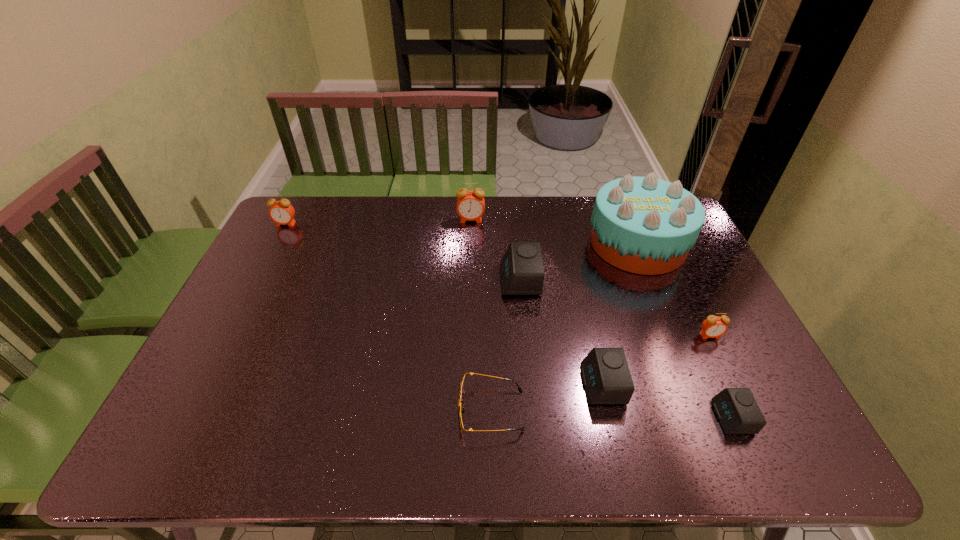
Where is `the second black alarm clock from right to left`? the second black alarm clock from right to left is located at coordinates (606, 377).

The image size is (960, 540). Identify the location of the rightmost black alarm clock. (737, 410).

You are a GUI agent. You are given a task and a screenshot of the screen. Output one action in this format:
    pyautogui.click(x=<x>, y=<y>)
    Task: Click on the smallest black alarm clock
    The width and height of the screenshot is (960, 540).
    Given the screenshot: What is the action you would take?
    pyautogui.click(x=737, y=410)

Find the location of `black sunglasses`. black sunglasses is located at coordinates (460, 410).

Locate an element on the screen. This screenshot has height=540, width=960. free space located 0.370m on the left of the tallest object is located at coordinates (478, 244).

At what (x,y) coordinates should I click in order to perform the action: click on free spot located on the face of the biggest pink alarm clock. Please return your answer as a coordinate pair (x, y). Looking at the image, I should click on (469, 274).

What are the coordinates of `free point located 0.130m on the face of the second smallest pink alarm clock` in the screenshot? It's located at (272, 251).

This screenshot has width=960, height=540. I want to click on vacant region located 0.350m on the front-facing side of the third farthest alarm clock, so click(387, 280).

You are a GUI agent. You are given a task and a screenshot of the screen. Output one action in this format:
    pyautogui.click(x=<x>, y=<y>)
    Task: Click on the vacant region located 0.330m on the front-facing side of the third farthest alarm clock
    
    Given the screenshot: What is the action you would take?
    pyautogui.click(x=394, y=280)

Where is `free space located on the front-facing side of the third farthest alarm clock`? The width and height of the screenshot is (960, 540). free space located on the front-facing side of the third farthest alarm clock is located at coordinates (416, 280).